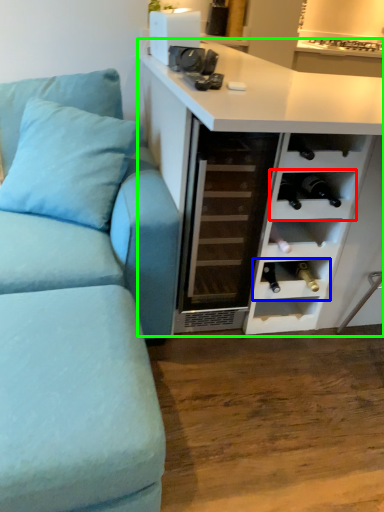
Question: Which object is the farthest from shelf (highlighted by a red box)? Choose among these: shelf (highlighted by a blue box) or cabinetry (highlighted by a green box).

Choices:
 (A) shelf
 (B) cabinetry

Answer: (A)